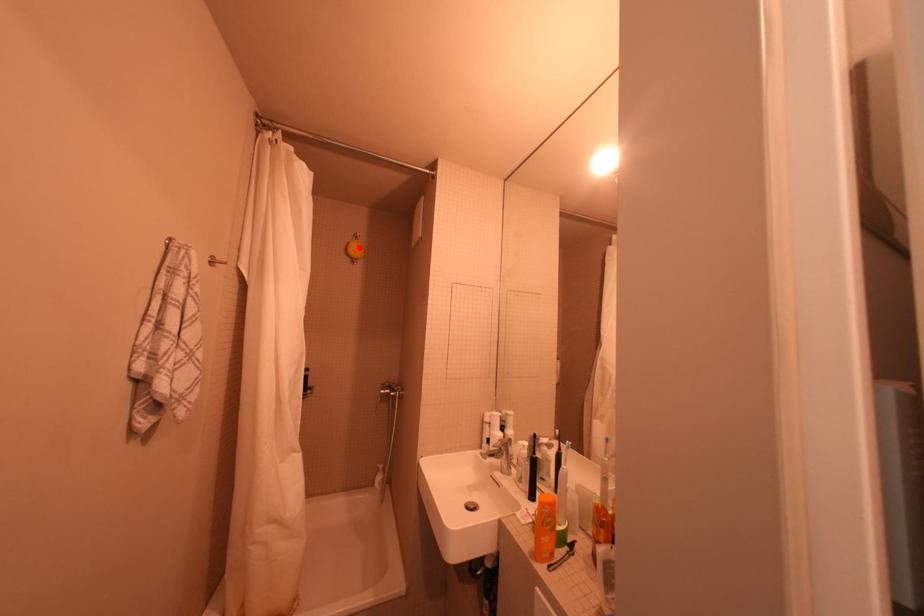
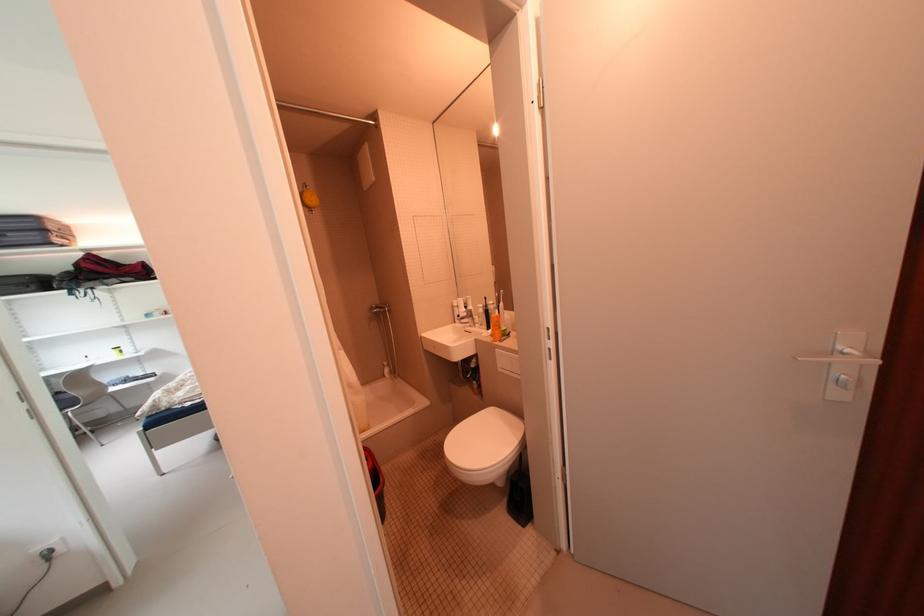
Find the pixel in the second image that matches the highlighted location in the first image.

(314, 198)